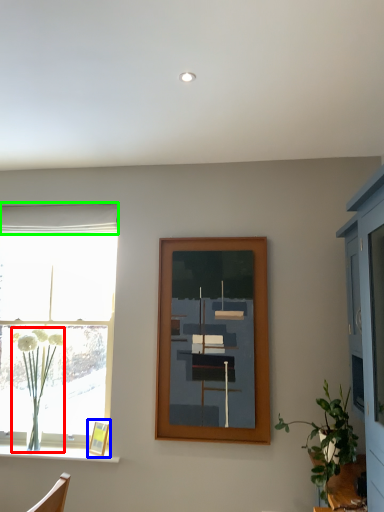
Question: Considering the real-world distances, which object is closest to plant (highlighted by a red box)? picture frame (highlighted by a blue box) or curtain (highlighted by a green box).

Choices:
 (A) picture frame
 (B) curtain

Answer: (A)